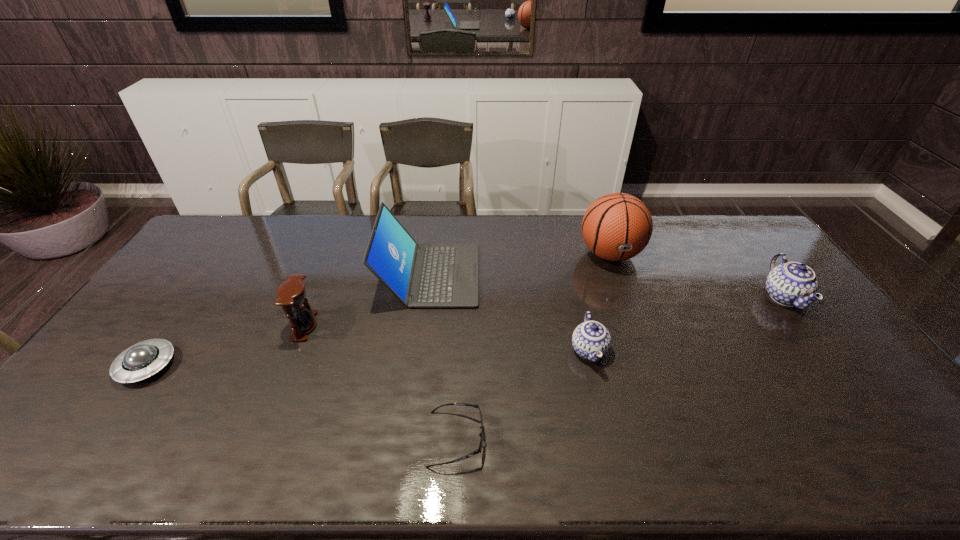
At what (x,y) coordinates should I click in order to perform the action: click on basketball. Please return your answer as a coordinate pair (x, y). The height and width of the screenshot is (540, 960). Looking at the image, I should click on (618, 226).

Where is `laptop computer`? The width and height of the screenshot is (960, 540). laptop computer is located at coordinates (428, 275).

At what (x,y) coordinates should I click in order to perform the action: click on the second object from left to right. Please return your answer as a coordinate pair (x, y). The image size is (960, 540). Looking at the image, I should click on (291, 294).

What are the coordinates of `the rightmost object` in the screenshot? It's located at (790, 284).

The height and width of the screenshot is (540, 960). I want to click on the farther chinaware, so click(790, 284).

Locate an element on the screen. the fifth tallest object is located at coordinates (591, 340).

Image resolution: width=960 pixels, height=540 pixels. I want to click on the left chinaware, so click(591, 340).

Locate an element on the screen. This screenshot has width=960, height=540. the leftmost object is located at coordinates (140, 361).

This screenshot has width=960, height=540. I want to click on the second shortest object, so click(140, 361).

Find the location of a particular element. sunglasses is located at coordinates (479, 450).